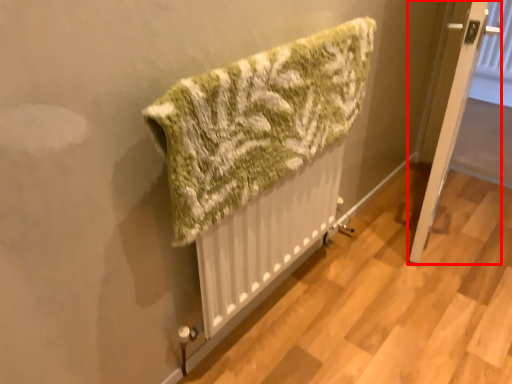
Question: Observing the image, what is the correct spatial positioning of door (annotated by the red box) in reference to towel?

Choices:
 (A) right
 (B) left

Answer: (A)